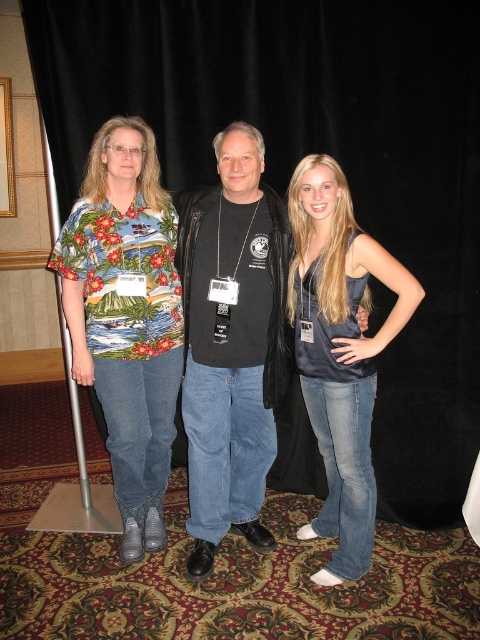
You are a photographer at a formal event. You need to ensure that the black matte shirt at center and the satin blue tank top at center are visible in the photo. Given their sizes, which one might require more careful framing to avoid being overwhelmed by the other?

The satin blue tank top at center is narrower than the black matte shirt at center. Since the black matte shirt at center is wider, it could potentially overshadow the satin blue tank top at center in the frame. To prevent this, you should focus on positioning the satin blue tank top at center in a way that balances its smaller width against the broader black matte shirt at center.

Where is the floral print shirt at left located in the image?

The floral print shirt at left is located at the 2D coordinates point (127, 317) in the image.